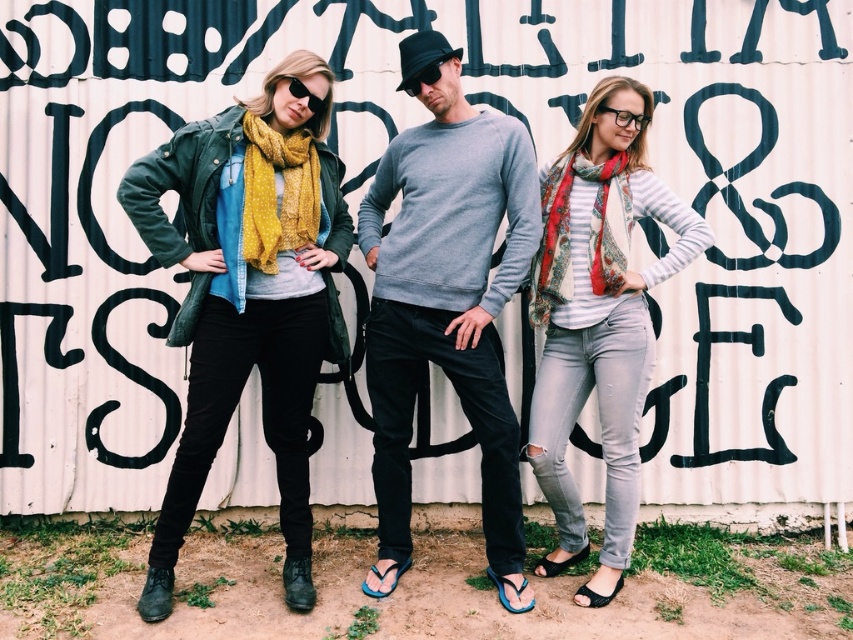
Is gray cotton sweater at center below black matte sunglasses at upper center?

Yes.

I want to click on gray cotton sweater at center, so click(x=445, y=304).

Where is `gray cotton sweater at center`? This screenshot has height=640, width=853. gray cotton sweater at center is located at coordinates (445, 304).

Between gray cotton sweater at center and printed silk scarf at right, which one is positioned lower?

Positioned lower is gray cotton sweater at center.

Who is taller, gray cotton sweater at center or printed silk scarf at right?

With more height is gray cotton sweater at center.

I want to click on gray cotton sweater at center, so click(x=445, y=304).

The width and height of the screenshot is (853, 640). What are the coordinates of `striped cotton shirt at center` in the screenshot? It's located at (598, 323).

Where is `striped cotton shirt at center`? The width and height of the screenshot is (853, 640). striped cotton shirt at center is located at coordinates (598, 323).